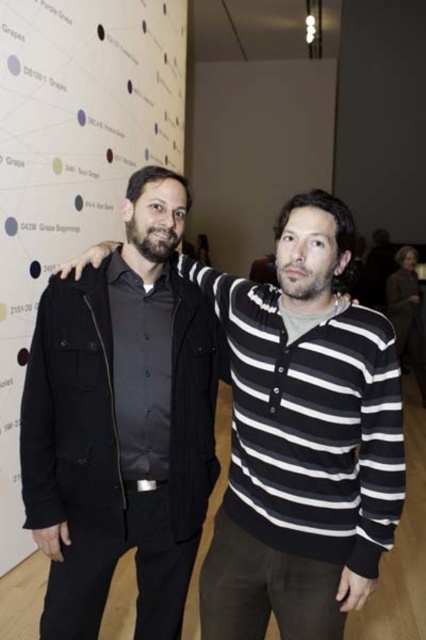
Is point (379, 518) in front of point (39, 44)?

Yes, point (379, 518) is closer to viewer.

The image size is (426, 640). What do you see at coordinates (302, 438) in the screenshot? I see `black matte jacket at left` at bounding box center [302, 438].

Between point (308, 259) and point (169, 42), which one is positioned in front?

Point (308, 259) is more forward.

Locate an element on the screen. Image resolution: width=426 pixels, height=640 pixels. black matte jacket at left is located at coordinates (302, 438).